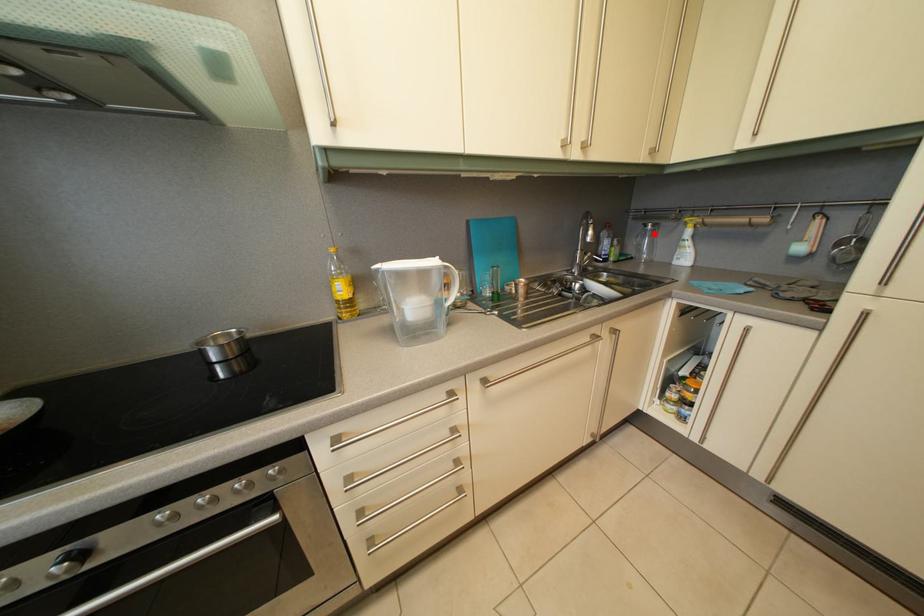
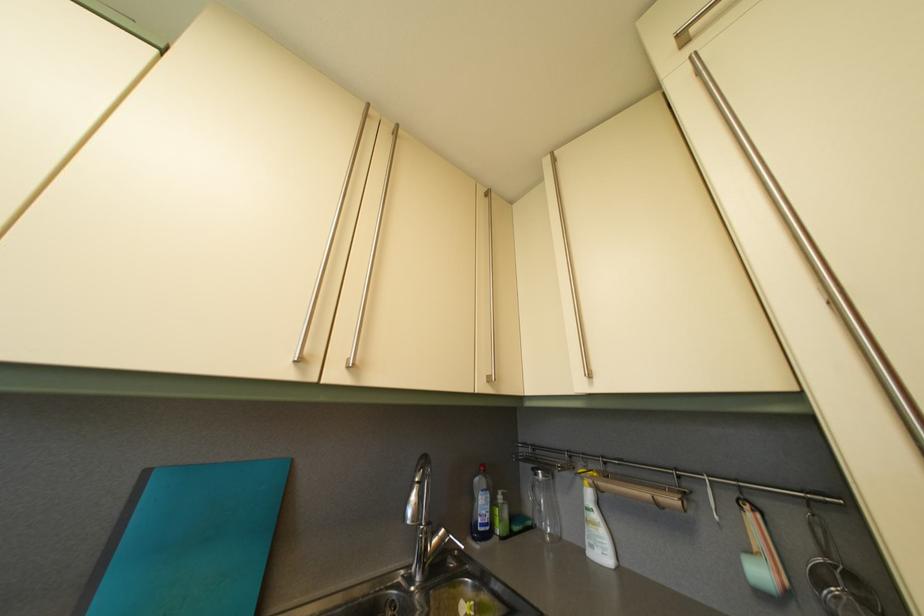
Question: I am providing you with two images of the same scene from different viewpoints. A red point is shown in image1. For the corresponding object point in image2, is it positioned nearer or farther from the camera?

Choices:
 (A) Nearer
 (B) Farther

Answer: (B)